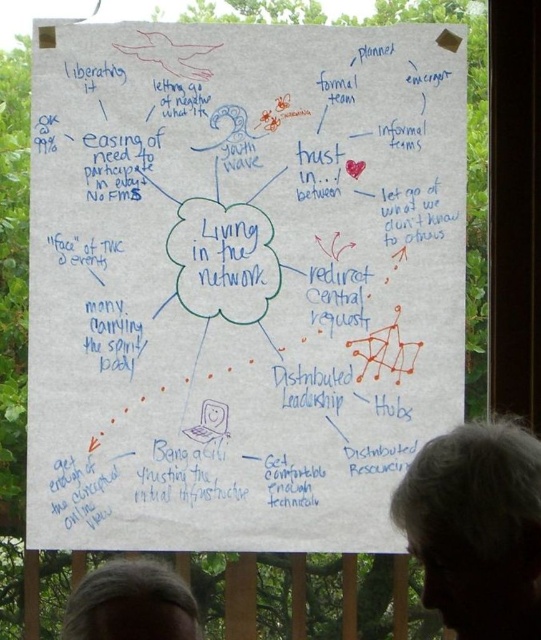
Question: Is gray hair at lower right smaller than gray hair at lower left?

Choices:
 (A) no
 (B) yes

Answer: (A)

Question: Can you confirm if white paper at center is thinner than gray hair at lower left?

Choices:
 (A) yes
 (B) no

Answer: (B)

Question: Which object appears farthest from the camera in this image?

Choices:
 (A) gray hair at lower left
 (B) gray hair at lower right

Answer: (A)

Question: Where is white paper at center located in relation to gray hair at lower left in the image?

Choices:
 (A) above
 (B) below

Answer: (A)

Question: Which of the following is the closest to the observer?

Choices:
 (A) gray hair at lower right
 (B) gray hair at lower left
 (C) white paper at center

Answer: (A)

Question: Considering the real-world distances, which object is farthest from the gray hair at lower right?

Choices:
 (A) gray hair at lower left
 (B) white paper at center

Answer: (B)